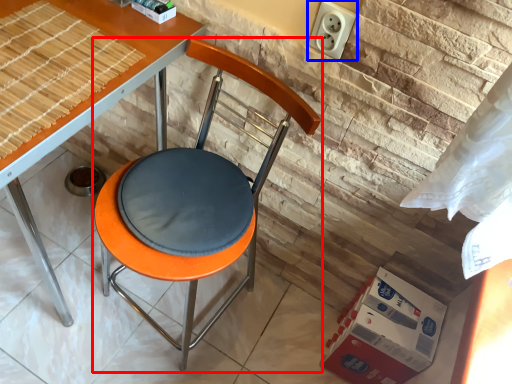
Question: Which object is closer to the camera taking this photo, chair (highlighted by a red box) or electric outlet (highlighted by a blue box)?

Choices:
 (A) chair
 (B) electric outlet

Answer: (A)